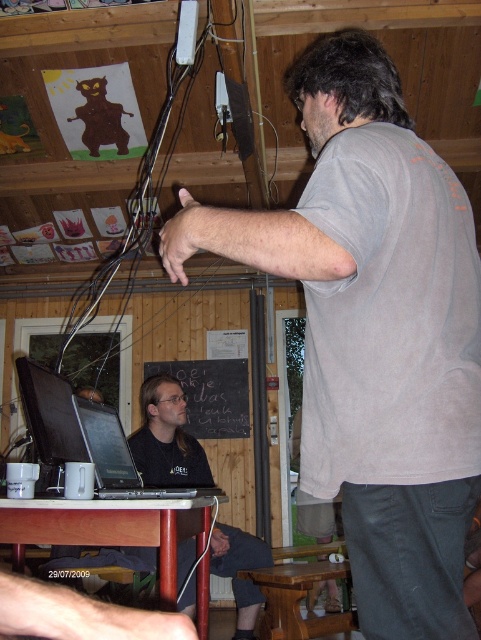
In the scene, there is a man standing and a person seated at a table. Where is the point located at coordinates (x=166, y=438) in relation to the black matte shirt at lower left?

The point at coordinates (x=166, y=438) corresponds to the black matte shirt at lower left.